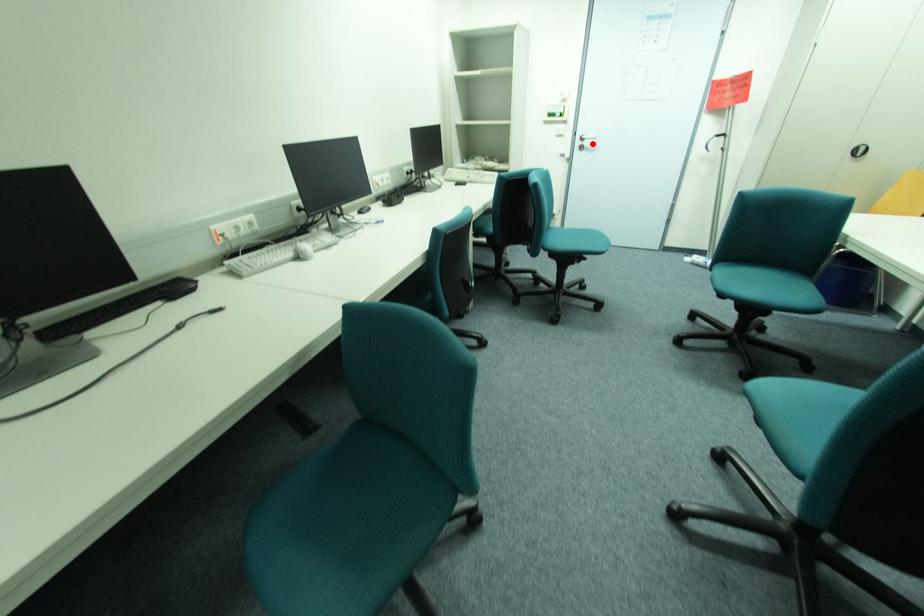
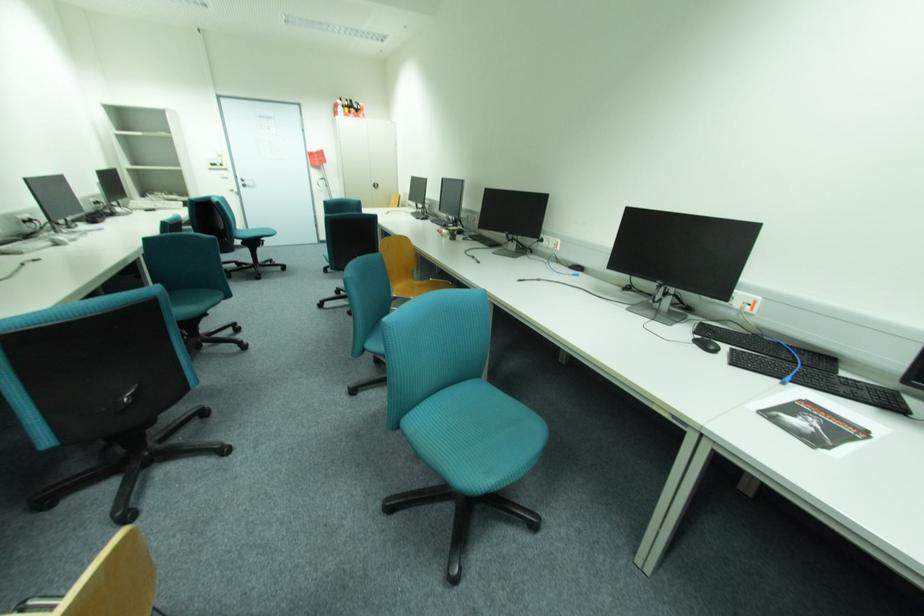
The point at the highlighted location is marked in the first image. Where is the corresponding point in the second image?

(253, 183)